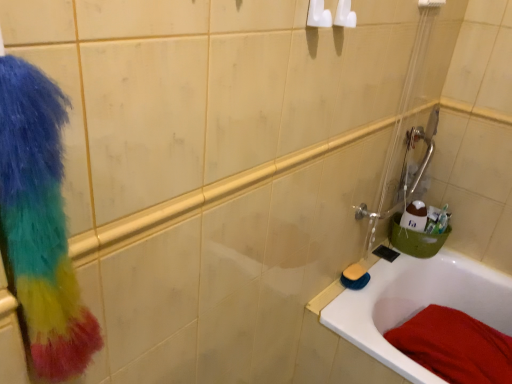
Find the location of a particular element. The width and height of the screenshot is (512, 384). vacant space in front of yellow sponge at lower right is located at coordinates (350, 311).